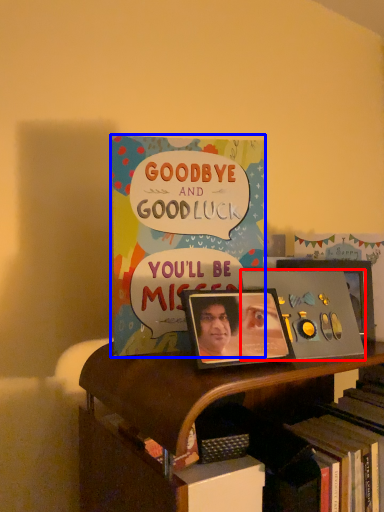
Question: Which object appears closest to the camera in this image, album cover (highlighted by a red box) or book (highlighted by a blue box)?

Choices:
 (A) album cover
 (B) book

Answer: (A)